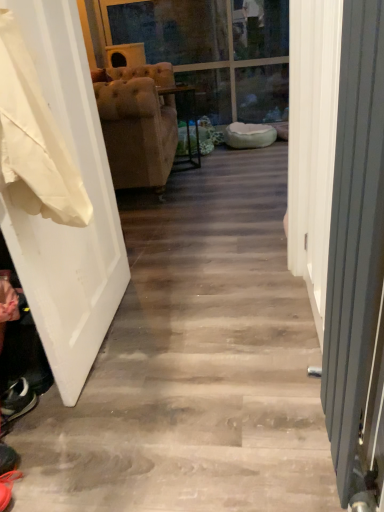
Image resolution: width=384 pixels, height=512 pixels. Identify the location of white fabric at left. (x=34, y=140).

Where is `shiny black shoe at lower left`? Image resolution: width=384 pixels, height=512 pixels. shiny black shoe at lower left is located at coordinates (8, 458).

What do you see at coordinates (214, 49) in the screenshot?
I see `transparent glass door at upper center` at bounding box center [214, 49].

Where is `suede-like beige armchair at center`? The width and height of the screenshot is (384, 512). suede-like beige armchair at center is located at coordinates (186, 125).

What are the coordinates of `white fabric at left` in the screenshot? It's located at (34, 140).

Which is more distant, [226,29] or [73,252]?

The point [226,29] is farther.

From the image's perspective, which object appears higher, transparent glass door at upper center or white matte door at left?

transparent glass door at upper center appears higher in the image.

Could you tell me if transparent glass door at upper center is turned towards white matte door at left?

No, transparent glass door at upper center does not turn towards white matte door at left.

Identify the location of door on the left of the transparent glass door at upper center. The width and height of the screenshot is (384, 512). (64, 225).

I want to click on footwear below the transparent glass door at upper center (from a real-world perspective), so click(8, 458).

Consider the image. In terms of height, does transparent glass door at upper center look taller or shorter compared to shiny black shoe at lower left?

Considering their sizes, transparent glass door at upper center has more height than shiny black shoe at lower left.

Is transparent glass door at upper center next to shiny black shoe at lower left and touching it?

No, transparent glass door at upper center is not next to shiny black shoe at lower left.

Considering the relative sizes of transparent glass door at upper center and shiny black shoe at lower left in the image provided, is transparent glass door at upper center wider than shiny black shoe at lower left?

Indeed, transparent glass door at upper center has a greater width compared to shiny black shoe at lower left.

Consider the image. Is white fabric at left wider than transparent glass door at upper center?

Incorrect, the width of white fabric at left does not surpass that of transparent glass door at upper center.

Considering the points (64, 175) and (220, 0), which point is behind, point (64, 175) or point (220, 0)?

The point (220, 0) is more distant.

In the scene shown: Which of these two, white fabric at left or transparent glass door at upper center, is bigger?

Bigger between the two is transparent glass door at upper center.

Would you say white fabric at left contains transparent glass door at upper center?

No, transparent glass door at upper center is located outside of white fabric at left.

Considering the positions of objects metallic gray radiator at right and suede-like beige armchair at center in the image provided, who is more to the right, metallic gray radiator at right or suede-like beige armchair at center?

metallic gray radiator at right is more to the right.

Does metallic gray radiator at right touch suede-like beige armchair at center?

metallic gray radiator at right and suede-like beige armchair at center are clearly separated.

From the image's perspective, is metallic gray radiator at right on suede-like beige armchair at center?

No, from the image's perspective, metallic gray radiator at right is not over suede-like beige armchair at center.

What's the angular difference between metallic gray radiator at right and suede-like beige armchair at center's facing directions?

metallic gray radiator at right and suede-like beige armchair at center are facing 116 degrees away from each other.

Considering the sizes of shiny black shoe at lower left and white matte door at left in the image, is shiny black shoe at lower left taller or shorter than white matte door at left?

Considering their sizes, shiny black shoe at lower left has less height than white matte door at left.

Is shiny black shoe at lower left facing towards white matte door at left?

No, shiny black shoe at lower left does not turn towards white matte door at left.

Considering the positions of objects shiny black shoe at lower left and white matte door at left in the image provided, who is more to the left, shiny black shoe at lower left or white matte door at left?

shiny black shoe at lower left.

Does shiny black shoe at lower left have a lesser width compared to white matte door at left?

No, shiny black shoe at lower left is not thinner than white matte door at left.

Is white matte door at left closer to the viewer compared to metallic gray radiator at right?

No, the depth of white matte door at left is greater than that of metallic gray radiator at right.

Where is `screen door below the white matte door at left (from the image's perspective)`? The height and width of the screenshot is (512, 384). screen door below the white matte door at left (from the image's perspective) is located at coordinates (357, 267).

Is there a large distance between white matte door at left and metallic gray radiator at right?

No.

From the image's perspective, relative to metallic gray radiator at right, is white matte door at left above or below?

white matte door at left is above metallic gray radiator at right.

Could you tell me if transparent glass door at upper center is turned towards metallic gray radiator at right?

No, transparent glass door at upper center is not facing towards metallic gray radiator at right.

Does transparent glass door at upper center have a lesser width compared to metallic gray radiator at right?

No.

What are the coordinates of `glass door behind the metallic gray radiator at right` in the screenshot? It's located at (214, 49).

Image resolution: width=384 pixels, height=512 pixels. In order to click on glass door above the white matte door at left (from a real-world perspective) in this screenshot , I will do `click(214, 49)`.

What are the coordinates of `glass door located behind the shiny black shoe at lower left` in the screenshot? It's located at (214, 49).

Based on the photo, when comparing their distances from transparent glass door at upper center, does white fabric at left or suede-like beige armchair at center seem further?

white fabric at left is further to transparent glass door at upper center.

From the picture: Estimate the real-world distances between objects in this image. Which object is closer to white matte door at left, white fabric at left or suede-like beige armchair at center?

white fabric at left is positioned closer to the anchor white matte door at left.

Looking at the image, which one is located closer to white fabric at left, shiny black shoe at lower left or transparent glass door at upper center?

Among the two, shiny black shoe at lower left is located nearer to white fabric at left.

When comparing their distances from metallic gray radiator at right, does shiny black shoe at lower left or white fabric at left seem further?

Among the two, shiny black shoe at lower left is located further to metallic gray radiator at right.

When comparing their distances from transparent glass door at upper center, does suede-like beige armchair at center or white matte door at left seem further?

Among the two, white matte door at left is located further to transparent glass door at upper center.

Looking at the image, which one is located further to suede-like beige armchair at center, transparent glass door at upper center or white fabric at left?

Based on the image, white fabric at left appears to be further to suede-like beige armchair at center.

Looking at the image, which one is located further to shiny black shoe at lower left, metallic gray radiator at right or transparent glass door at upper center?

Based on the image, transparent glass door at upper center appears to be further to shiny black shoe at lower left.

Estimate the real-world distances between objects in this image. Which object is further from white matte door at left, white fabric at left or metallic gray radiator at right?

The object further to white matte door at left is metallic gray radiator at right.

Locate an element on the screen. The width and height of the screenshot is (384, 512). footwear between white matte door at left and transparent glass door at upper center in the front-back direction is located at coordinates (8, 458).

Find the location of `door located between metallic gray radiator at right and transparent glass door at upper center in the depth direction`. door located between metallic gray radiator at right and transparent glass door at upper center in the depth direction is located at coordinates (64, 225).

Identify the location of footwear positioned between metallic gray radiator at right and transparent glass door at upper center from near to far. (8, 458).

Locate an element on the screen. footwear between white matte door at left and suede-like beige armchair at center from front to back is located at coordinates (8, 458).